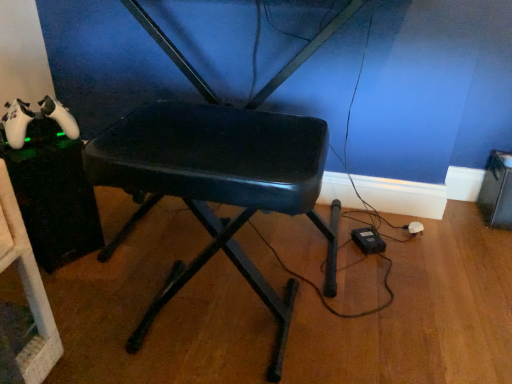
Question: Should I look upward or downward to see matte black stool at center?

Choices:
 (A) up
 (B) down

Answer: (B)